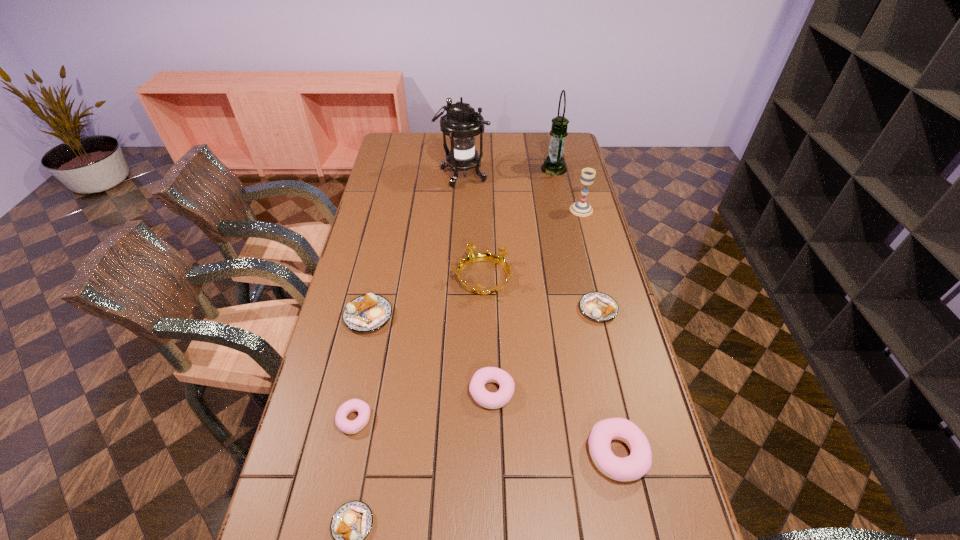
At what (x,y) coordinates should I click in order to perform the action: click on vacant space situated on the left of the third pastry from right to left. Please return your answer as a coordinate pair (x, y). Image resolution: width=960 pixels, height=540 pixels. Looking at the image, I should click on (440, 392).

Locate an element on the screen. free location located on the front of the rightmost brown pastry is located at coordinates tap(611, 361).

At what (x,y) coordinates should I click in order to perform the action: click on vacant space located 0.300m on the right of the smallest pink pastry. Please return your answer as a coordinate pair (x, y). The image size is (960, 540). Looking at the image, I should click on (489, 419).

Identify the location of lantern that is at the right edge. (554, 164).

The height and width of the screenshot is (540, 960). I want to click on chalice at the right edge, so click(581, 208).

Identify the location of vacant area at the far edge of the desktop. (520, 136).

You are a GUI agent. You are given a task and a screenshot of the screen. Output one action in this format:
    pyautogui.click(x=<x>, y=<y>)
    Task: Click on the vacant space at the left edge of the desktop
    The height and width of the screenshot is (540, 960).
    Given the screenshot: What is the action you would take?
    pyautogui.click(x=394, y=180)

In the image, there is a desktop. Where is `vacant area at the right edge`? vacant area at the right edge is located at coordinates (583, 275).

In the image, there is a desktop. Where is `blank space at the far left corner`? This screenshot has width=960, height=540. blank space at the far left corner is located at coordinates (405, 158).

This screenshot has width=960, height=540. In the image, there is a desktop. What are the coordinates of `vacant area at the far right corner` in the screenshot? It's located at (540, 141).